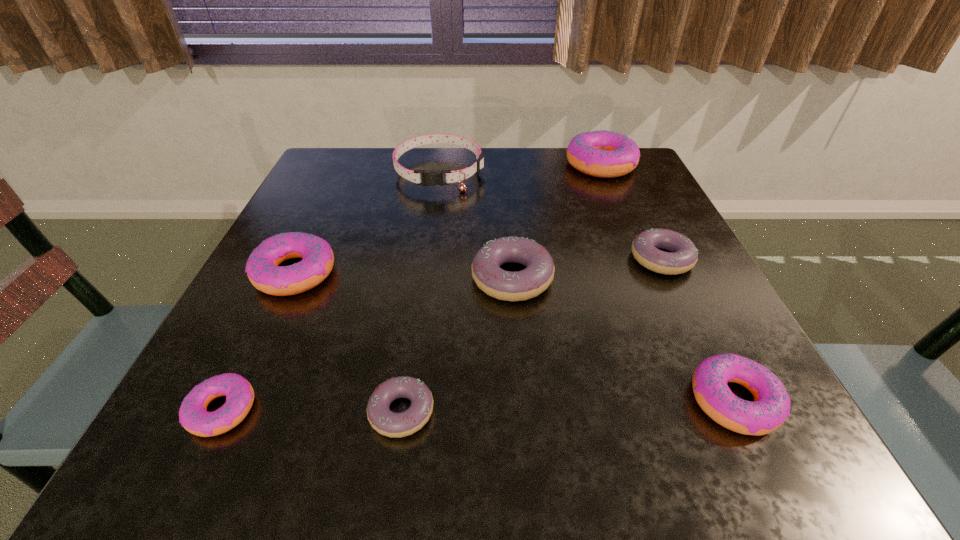
Identify the location of the biggest pink doughnut. The height and width of the screenshot is (540, 960). (605, 154).

The width and height of the screenshot is (960, 540). In order to click on the farthest pink doughnut in this screenshot , I will do `click(605, 154)`.

Locate an element on the screen. The image size is (960, 540). dog collar is located at coordinates (429, 178).

Locate an element on the screen. the fourth doughnut from right to left is located at coordinates (522, 285).

You are a GUI agent. You are given a task and a screenshot of the screen. Output one action in this format:
    pyautogui.click(x=<x>, y=<y>)
    Task: Click on the second purple doughnut from right to left
    This screenshot has height=540, width=960.
    Given the screenshot: What is the action you would take?
    pyautogui.click(x=522, y=285)

The width and height of the screenshot is (960, 540). I want to click on the third smallest pink doughnut, so click(262, 268).

Where is `the second smallest purple doughnut`? The image size is (960, 540). the second smallest purple doughnut is located at coordinates (683, 255).

Where is `the third biggest pink doughnut`? the third biggest pink doughnut is located at coordinates (771, 406).

The image size is (960, 540). I want to click on the third doughnut from left to right, so click(395, 425).

The width and height of the screenshot is (960, 540). I want to click on the smallest purple doughnut, so [395, 425].